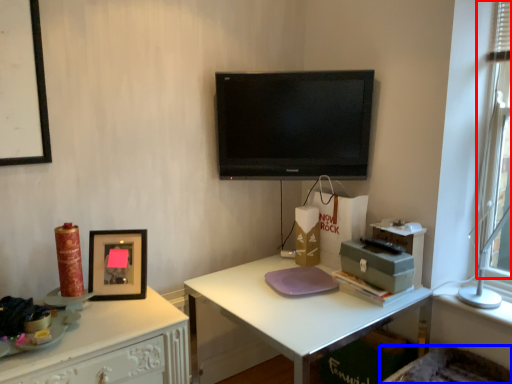
Question: Which object appears closest to the camera in this image, window screen (highlighted by a red box) or swivel chair (highlighted by a blue box)?

Choices:
 (A) window screen
 (B) swivel chair

Answer: (B)